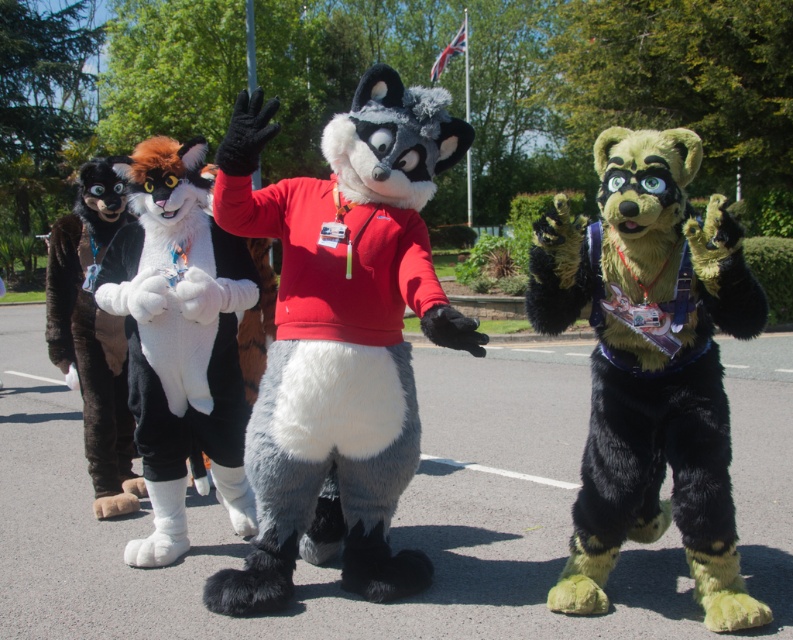
Which is behind, point (671, 136) or point (156, 403)?

The point (156, 403) is behind.

Based on the photo, is fluffy green fur at center smaller than white plush cat at center?

Actually, fluffy green fur at center might be larger than white plush cat at center.

Where is `fluffy green fur at center`? Image resolution: width=793 pixels, height=640 pixels. fluffy green fur at center is located at coordinates (650, 365).

The height and width of the screenshot is (640, 793). I want to click on fluffy green fur at center, so click(x=650, y=365).